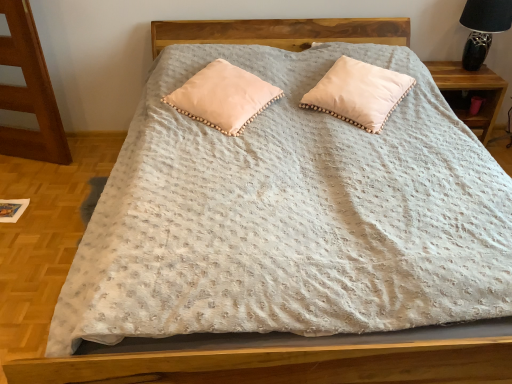
I want to click on vacant space underneath black ceramic table lamp at upper right (from a real-world perspective), so click(474, 72).